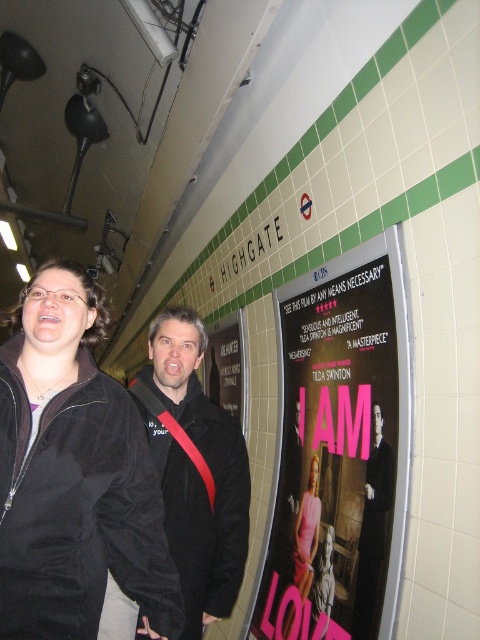
Question: Does pink paper poster at center lie behind pink satin dress at center?

Choices:
 (A) no
 (B) yes

Answer: (A)

Question: Among these points, which one is nearest to the camera?

Choices:
 (A) (84, 337)
 (B) (373, 449)

Answer: (A)

Question: Can you confirm if velvet black jacket at center is bigger than pink satin dress at center?

Choices:
 (A) yes
 (B) no

Answer: (A)

Question: Which point is farther from the camera taking this photo?

Choices:
 (A) (328, 500)
 (B) (316, 497)
 (C) (160, 355)
 (D) (364, 570)

Answer: (B)

Question: Is black matte jacket at center positioned at the back of black matte suit at center?

Choices:
 (A) yes
 (B) no

Answer: (B)

Question: Among these points, which one is farthest from the camera?

Choices:
 (A) (71, 332)
 (B) (192, 522)
 (C) (305, 548)

Answer: (C)